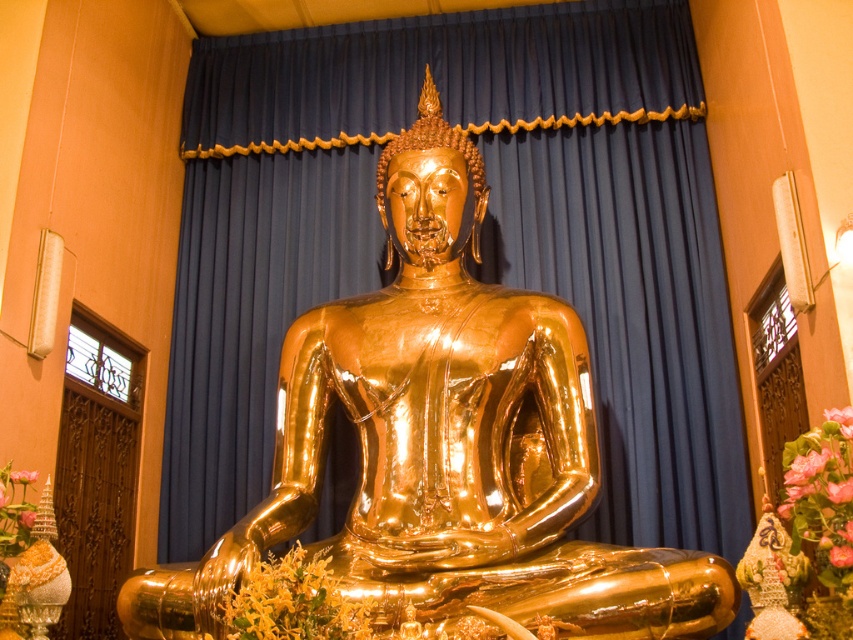
Question: Is the position of gold shiny statue at center less distant than that of pink silk flower at lower right?

Choices:
 (A) no
 (B) yes

Answer: (A)

Question: Which object is farther from the camera taking this photo?

Choices:
 (A) yellow-green floral decoration at lower center
 (B) pink floral bouquet at center
 (C) pink silk flower at lower right

Answer: (B)

Question: Which point is closer to the camera?

Choices:
 (A) gold shiny statue at center
 (B) pink silk flower at lower right

Answer: (B)

Question: Can you confirm if gold shiny statue at center is thinner than yellow-green floral decoration at lower center?

Choices:
 (A) yes
 (B) no

Answer: (B)

Question: Which object is positioned closest to the gold shiny statue at center?

Choices:
 (A) pink floral bouquet at center
 (B) yellow-green floral decoration at lower center
 (C) pink silk flower at lower right
 (D) pink silk flower at center

Answer: (B)

Question: Can you confirm if pink silk flower at lower right is positioned above pink silk flower at center?

Choices:
 (A) no
 (B) yes

Answer: (B)